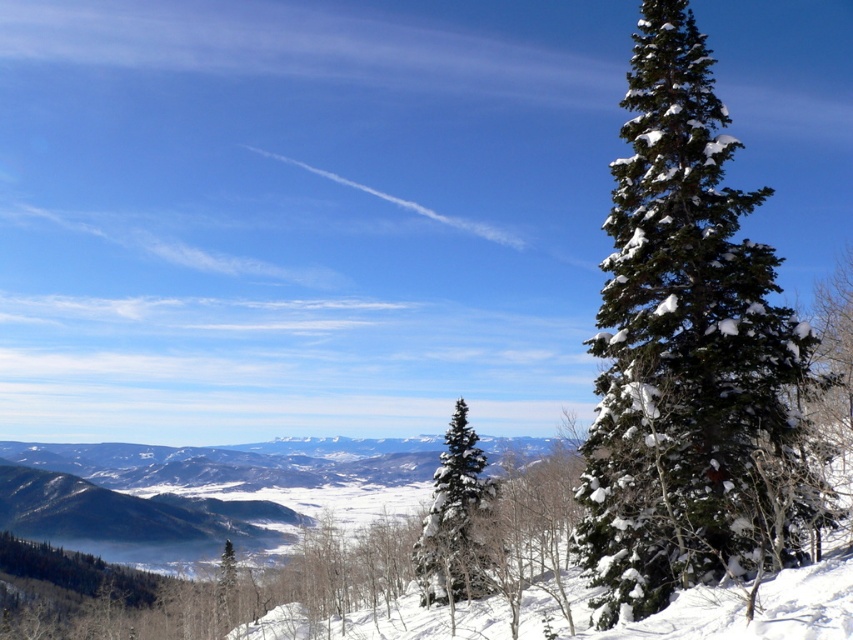
Based on the photo, you are standing in the winter landscape and want to walk from the point at coordinates point (x=695, y=320) to the point at coordinates point (x=416, y=547). Which direction should you move relative to your current position to reach the second point?

To move from point (x=695, y=320) to point (x=416, y=547), you should move towards the lower right direction since point (x=416, y=547) is further away from the camera compared to point (x=695, y=320).